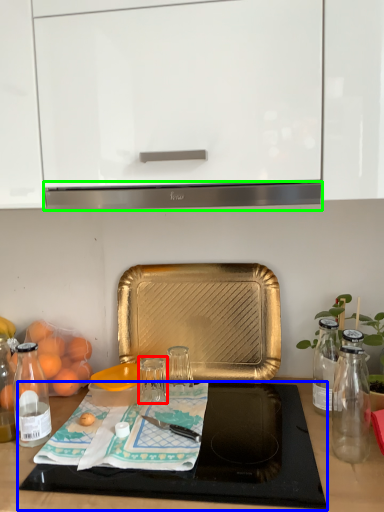
Question: Which is nearer to the glass jar (highlighted by a red box)? cutting board (highlighted by a blue box) or exhaust hood (highlighted by a green box).

Choices:
 (A) cutting board
 (B) exhaust hood

Answer: (A)